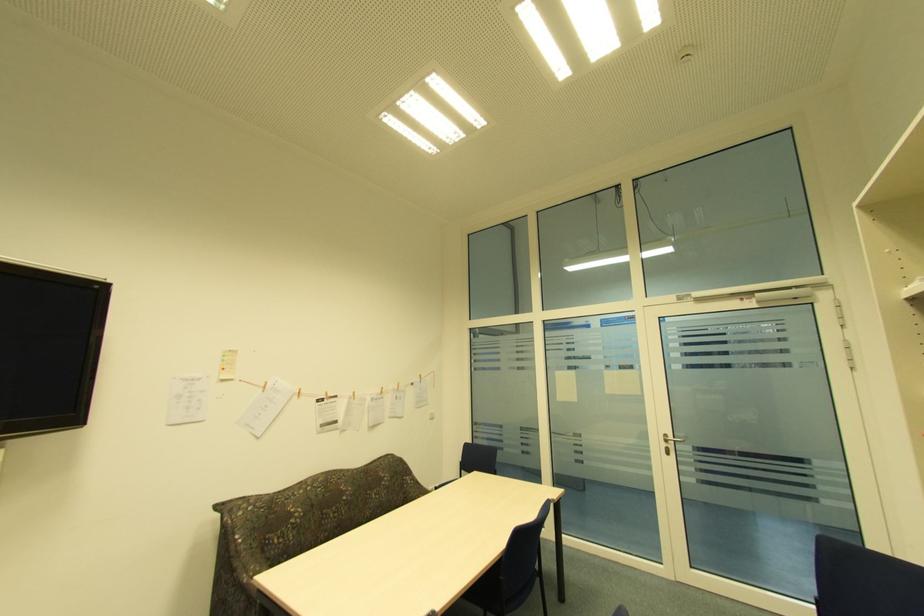
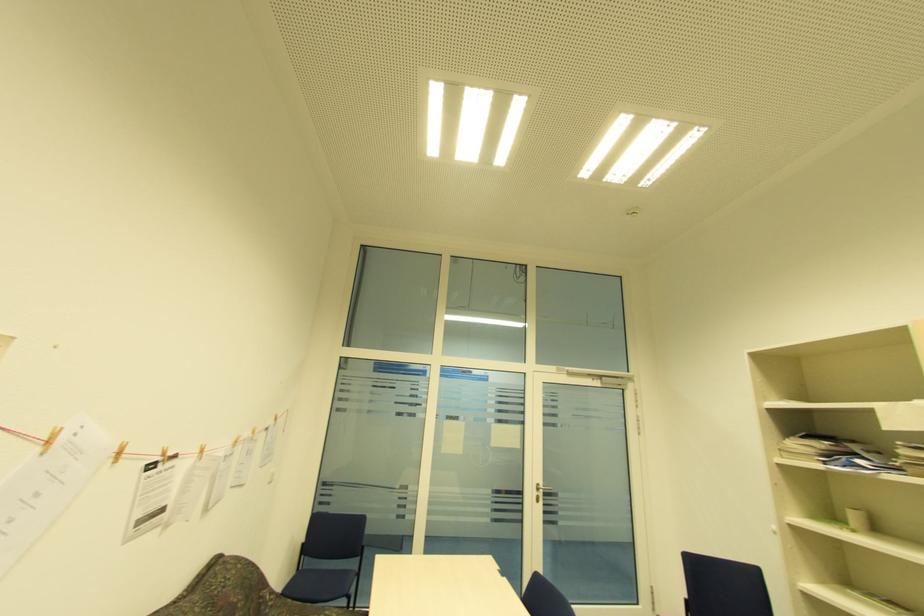
Locate, in the second image, the point that corresponds to the point at 301,392 in the first image.

(120, 454)